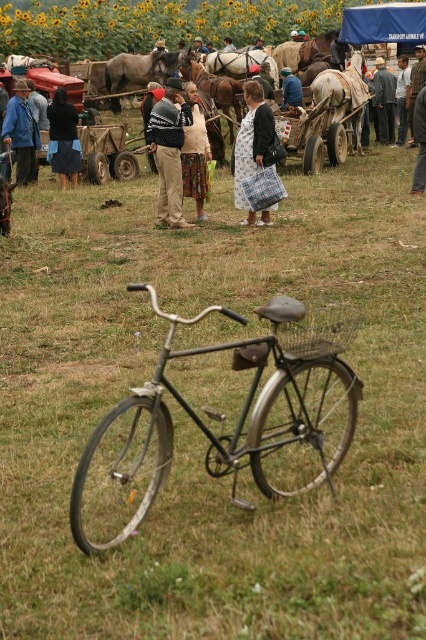
Question: Can you confirm if khaki pants at center is wider than brown leather horse at upper center?

Choices:
 (A) no
 (B) yes

Answer: (A)

Question: Which point appears farthest from the camera in this image?

Choices:
 (A) (304, 468)
 (B) (207, 77)
 (C) (219, 58)

Answer: (C)

Question: Does plaid fabric bag at center appear on the right side of white glossy horse at upper center?

Choices:
 (A) no
 (B) yes

Answer: (B)

Question: Is white glossy horse at upper center positioned behind blue fabric dress at center?

Choices:
 (A) yes
 (B) no

Answer: (A)

Question: Which point is closer to the camera?

Choices:
 (A) blue denim jacket at left
 (B) khaki pants at center

Answer: (B)

Question: Among these points, which one is nearest to the camera?

Choices:
 (A) pyautogui.click(x=400, y=58)
 (B) pyautogui.click(x=189, y=147)

Answer: (B)